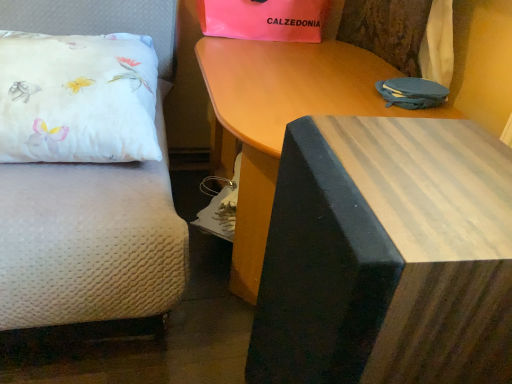
Question: From a real-world perspective, is white satin pillow at left beneath pink matte gift bag at upper center?

Choices:
 (A) no
 (B) yes

Answer: (B)

Question: Does white satin pillow at left have a lesser width compared to pink matte gift bag at upper center?

Choices:
 (A) yes
 (B) no

Answer: (B)

Question: Is the depth of white satin pillow at left greater than that of pink matte gift bag at upper center?

Choices:
 (A) yes
 (B) no

Answer: (B)

Question: Considering the relative sizes of white satin pillow at left and pink matte gift bag at upper center in the image provided, is white satin pillow at left shorter than pink matte gift bag at upper center?

Choices:
 (A) no
 (B) yes

Answer: (A)

Question: Is white satin pillow at left taller than pink matte gift bag at upper center?

Choices:
 (A) yes
 (B) no

Answer: (A)

Question: Is the position of white satin pillow at left less distant than that of pink matte gift bag at upper center?

Choices:
 (A) no
 (B) yes

Answer: (B)

Question: From the image's perspective, is wooden table at upper center, which is the 2th table from front to back, located beneath pink matte gift bag at upper center?

Choices:
 (A) no
 (B) yes

Answer: (B)

Question: Is the depth of wooden table at upper center, which is the 2th table from front to back, greater than that of pink matte gift bag at upper center?

Choices:
 (A) yes
 (B) no

Answer: (B)

Question: Does wooden table at upper center, which is the 2th table from front to back, appear on the left side of pink matte gift bag at upper center?

Choices:
 (A) no
 (B) yes

Answer: (A)

Question: Is wooden table at upper center, marked as the first table in a back-to-front arrangement, to the right of pink matte gift bag at upper center from the viewer's perspective?

Choices:
 (A) yes
 (B) no

Answer: (A)

Question: Is wooden table at upper center, which is the 2th table from front to back, facing towards pink matte gift bag at upper center?

Choices:
 (A) yes
 (B) no

Answer: (B)

Question: Does wooden table at upper center, which is the 2th table from front to back, come in front of pink matte gift bag at upper center?

Choices:
 (A) yes
 (B) no

Answer: (A)

Question: From the image's perspective, is wooden table at upper center, marked as the first table in a back-to-front arrangement, located beneath wooden table at center, the 1th table in the front-to-back sequence?

Choices:
 (A) yes
 (B) no

Answer: (B)